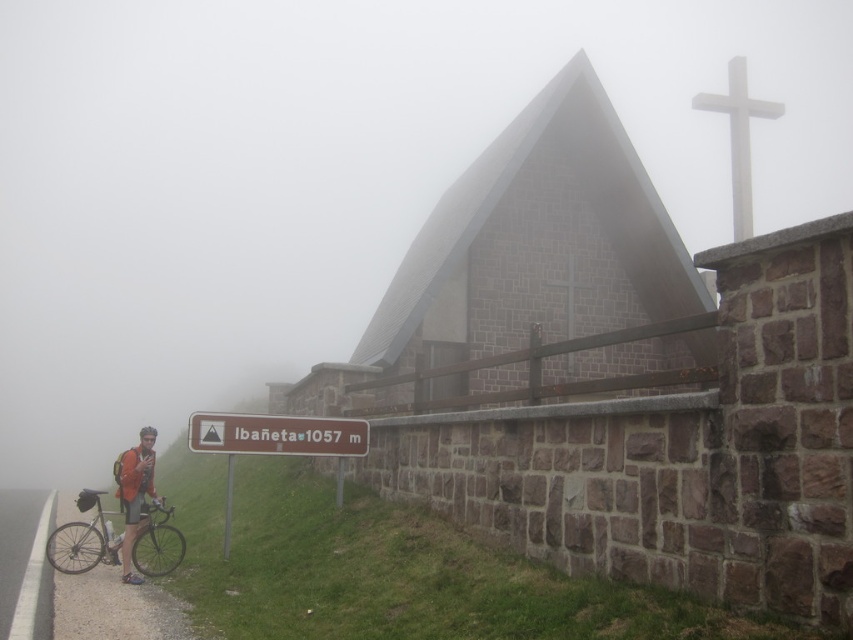
You are standing at the point with coordinates point (773, 109) and want to walk towards the point with coordinates point (428, 440). Which direction should you move relative to the camera?

You should move towards the camera because point (428, 440) is closer to the camera than point (773, 109).

You are a cyclist who wants to reach the white stone cross at upper right from your current position near the silver metallic bicycle at lower left. Considering the foggy conditions, can you estimate how far you need to travel to reach the cross?

The distance between the silver metallic bicycle at lower left and the white stone cross at upper right is 16.70 meters, so you need to travel approximately 16.70 meters to reach the cross.

You are a photographer planning to take a picture of the gray stone church at center and the matte orange jacket at lower left. Considering their sizes, which object should you focus on first to ensure both are in frame without zooming?

The gray stone church at center is bigger than the matte orange jacket at lower left, so you should focus on the matte orange jacket at lower left first to ensure both fit in the frame without zooming.